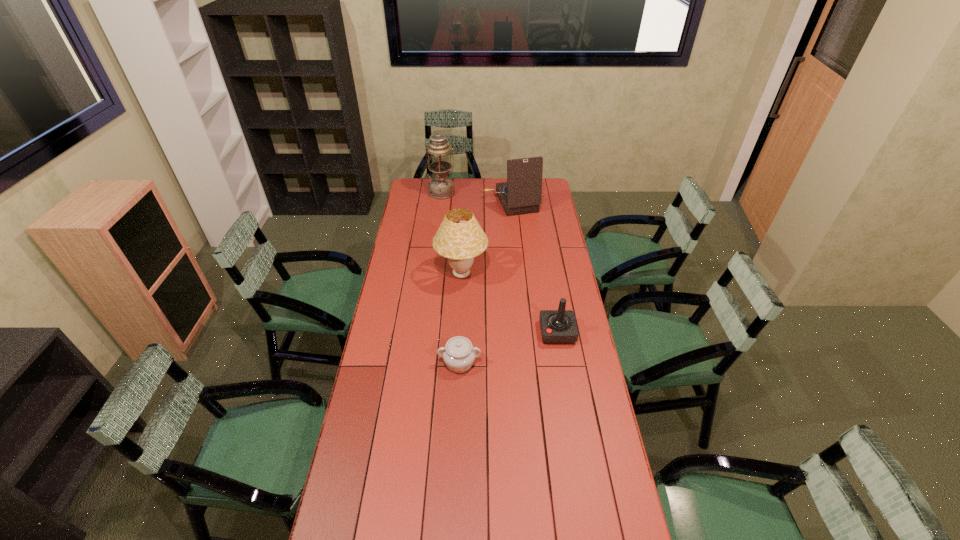
Identify the location of object that is positioned at the far right corner. (522, 193).

Identify the location of free region at the left edge. The image size is (960, 540). point(418,306).

You are a GUI agent. You are given a task and a screenshot of the screen. Output one action in this format:
    pyautogui.click(x=<x>, y=<y>)
    Task: Click on the free space at the right edge of the desktop
    The width and height of the screenshot is (960, 540).
    Given the screenshot: What is the action you would take?
    pyautogui.click(x=588, y=446)

Locate an element on the screen. This screenshot has width=960, height=540. free spot at the far left corner of the desktop is located at coordinates (423, 192).

Where is `free space that is in between the third nearest object and the joystick`? This screenshot has width=960, height=540. free space that is in between the third nearest object and the joystick is located at coordinates (510, 303).

The height and width of the screenshot is (540, 960). In order to click on vacant space in between the second nearest object and the oil lamp in this screenshot , I will do pyautogui.click(x=499, y=262).

Find the location of `vacant area that lies between the third farthest object and the fourth tallest object`. vacant area that lies between the third farthest object and the fourth tallest object is located at coordinates (510, 303).

This screenshot has width=960, height=540. What are the coordinates of `free space between the oil lamp and the joystick` in the screenshot? It's located at (499, 262).

Find the location of `object that is the closest to the phonograph record`. object that is the closest to the phonograph record is located at coordinates (441, 186).

The height and width of the screenshot is (540, 960). Find the location of `object that is the second closest to the phonograph record`. object that is the second closest to the phonograph record is located at coordinates (460, 238).